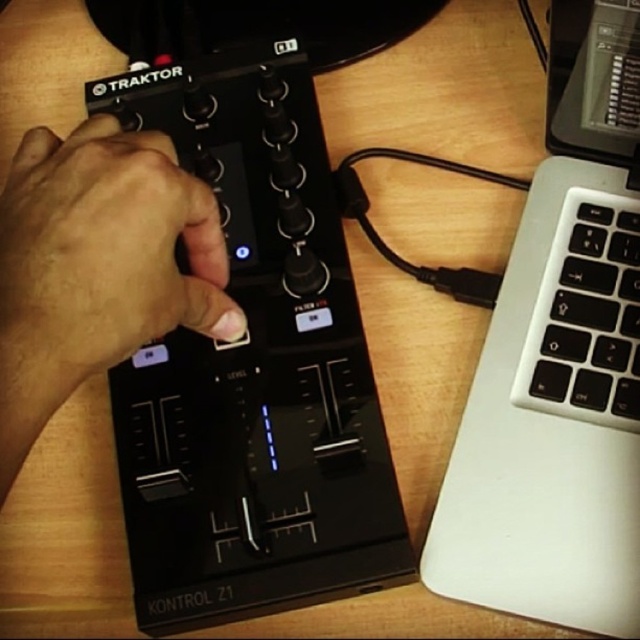
You are setting up a DJ station and need to place both the black matte hand at center and the white plastic keyboard at right on the table. Based on their sizes, which object requires more horizontal space on the table?

The black matte hand at center requires more horizontal space on the table since it might be wider than the white plastic keyboard at right.